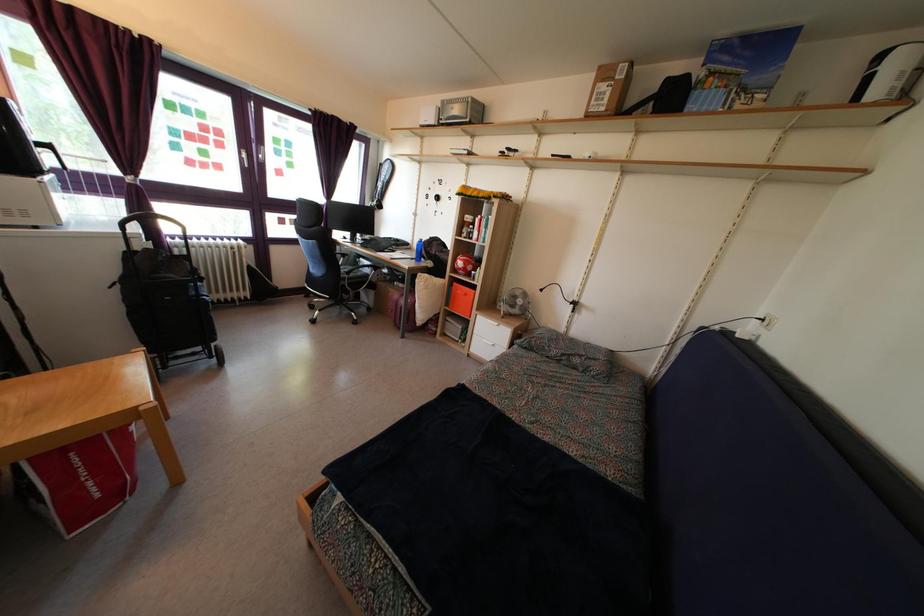
Find where to lift the book on shelf. Please return your answer as a coordinate pair (x, y).

(478, 224)